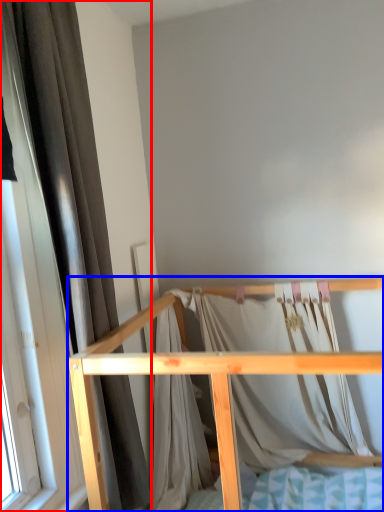
Question: Among these objects, which one is nearest to the camera, curtain (highlighted by a red box) or furniture (highlighted by a blue box)?

Choices:
 (A) curtain
 (B) furniture

Answer: (B)